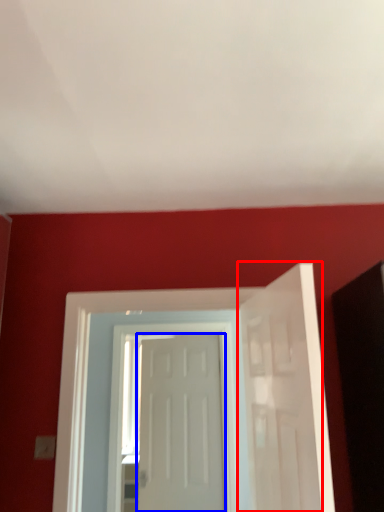
Question: Which object is closer to the camera taking this photo, door (highlighted by a red box) or door (highlighted by a blue box)?

Choices:
 (A) door
 (B) door

Answer: (A)